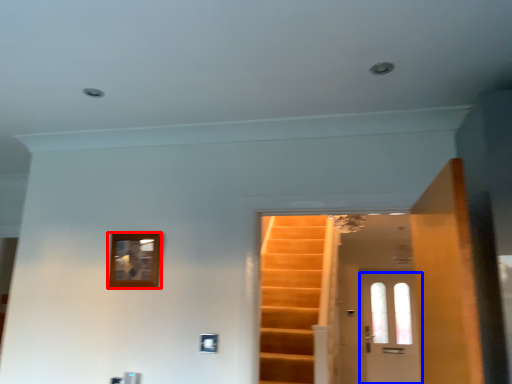
Question: Among these objects, which one is farthest to the camera, picture frame (highlighted by a red box) or door (highlighted by a blue box)?

Choices:
 (A) picture frame
 (B) door

Answer: (B)